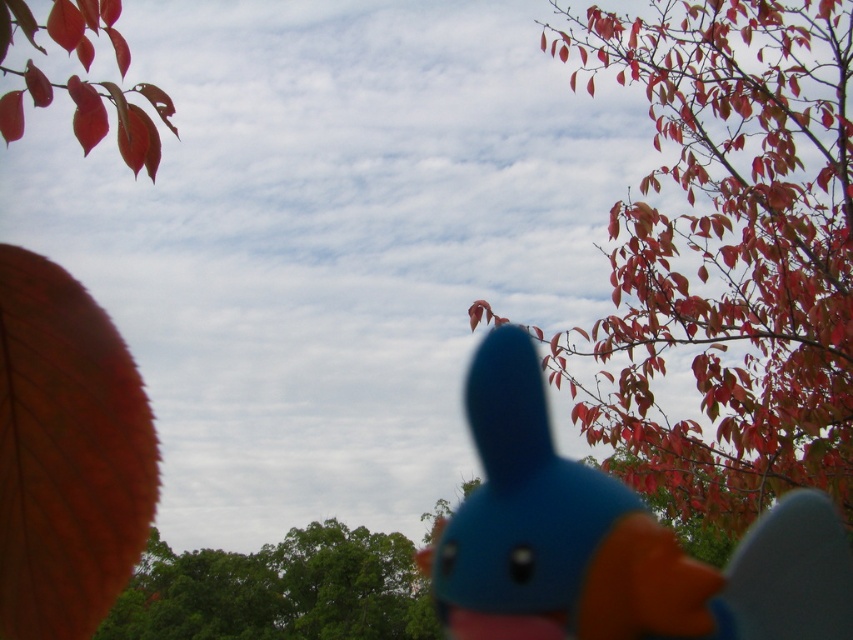
You are standing in the serene outdoor scene with the vibrant red leaves and the blue rabbit figurine. You notice two points marked in the image. Which point is closer to you, point (753, 556) or point (248, 573)?

Point (753, 556) is in front of point (248, 573), so it is closer to you.

You are a photographer trying to capture the blue rubber duck at center and the green leafy tree at lower left in the same frame. Based on their sizes in the image, which one would appear smaller?

The blue rubber duck at center appears smaller than the green leafy tree at lower left because it is not as tall.